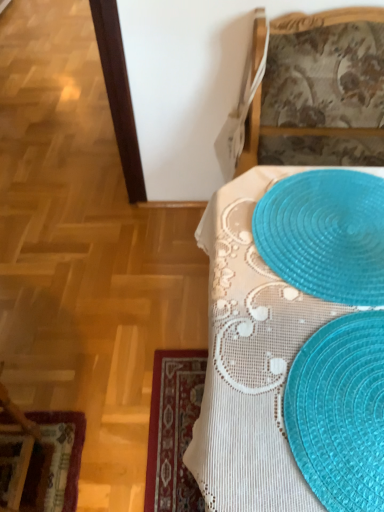
Identify the location of vacant region below translucent blue placemat at lower right (from a real-world perspective). The width and height of the screenshot is (384, 512). (349, 401).